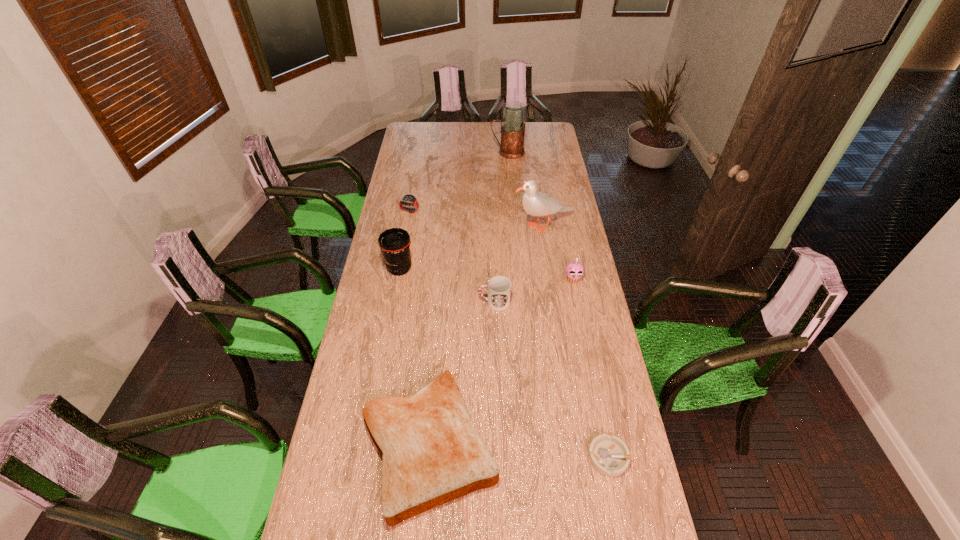
Where is `vacant space located with the handle on the side of the pitcher`? The width and height of the screenshot is (960, 540). vacant space located with the handle on the side of the pitcher is located at coordinates click(420, 152).

In order to click on vacant area located 0.330m with the handle on the side of the pitcher in this screenshot , I will do `click(433, 152)`.

At what (x,y) coordinates should I click in order to perform the action: click on vacant region located at the beak of the sixth nearest object. Please return your answer as a coordinate pair (x, y). The width and height of the screenshot is (960, 540). Looking at the image, I should click on (487, 226).

The width and height of the screenshot is (960, 540). Find the location of `blank area located at the beak of the sixth nearest object`. blank area located at the beak of the sixth nearest object is located at coordinates (480, 226).

Identify the location of vacant region located 0.180m at the beak of the sixth nearest object. This screenshot has height=540, width=960. (474, 226).

The width and height of the screenshot is (960, 540). Find the location of `vacant region located on the back of the telephoto lens`. vacant region located on the back of the telephoto lens is located at coordinates (411, 204).

I want to click on free location located on the face of the cupcake, so click(584, 332).

This screenshot has height=540, width=960. What are the coordinates of `vacant region located 0.320m on the side of the third nearest object where the handle is located` in the screenshot? It's located at (397, 302).

What are the coordinates of `vacant space located on the side of the third nearest object where the handle is located` in the screenshot? It's located at (413, 302).

This screenshot has height=540, width=960. In order to click on free space located 0.350m on the side of the third nearest object where the handle is located in this screenshot , I will do `click(390, 302)`.